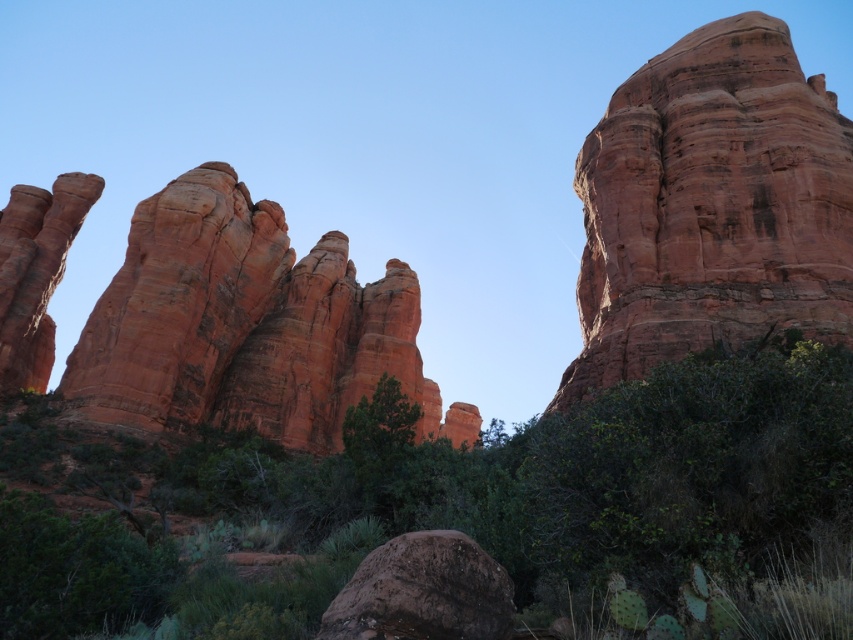
Is point (192, 412) farther from camera compared to point (735, 324)?

Yes, point (192, 412) is behind point (735, 324).

Can you confirm if rustic sandstone rock formation at left is shorter than rustic sandstone rock formation at upper right?

Incorrect, rustic sandstone rock formation at left's height does not fall short of rustic sandstone rock formation at upper right's.

Which is behind, point (274, 250) or point (659, 310)?

Positioned behind is point (274, 250).

You are a GUI agent. You are given a task and a screenshot of the screen. Output one action in this format:
    pyautogui.click(x=<x>, y=<y>)
    Task: Click on the rustic sandstone rock formation at left
    This screenshot has width=853, height=640.
    Given the screenshot: What is the action you would take?
    pyautogui.click(x=247, y=324)

Who is shorter, rustic sandstone rock formation at upper right or brown rough boulder at center?

brown rough boulder at center is shorter.

Measure the distance between rustic sandstone rock formation at upper right and camera.

rustic sandstone rock formation at upper right is 72.84 meters from camera.

The height and width of the screenshot is (640, 853). Find the location of `rustic sandstone rock formation at upper right`. rustic sandstone rock formation at upper right is located at coordinates (711, 205).

Does rustic sandstone rock formation at left appear over brown rough boulder at center?

Yes, rustic sandstone rock formation at left is above brown rough boulder at center.

Who is positioned more to the left, rustic sandstone rock formation at left or brown rough boulder at center?

Positioned to the left is rustic sandstone rock formation at left.

Is point (215, 324) positioned behind point (473, 554)?

That is True.

The height and width of the screenshot is (640, 853). Identify the location of rustic sandstone rock formation at left. (247, 324).